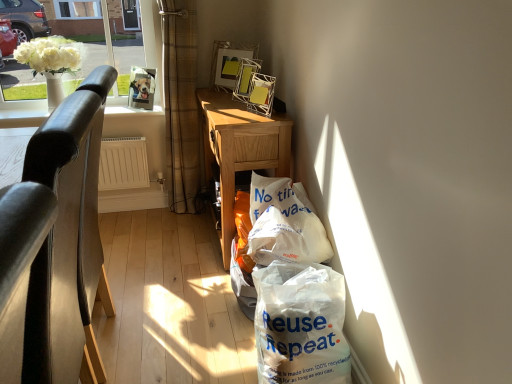
Question: Is black leather chair at left bigger or smaller than wooden desk at center?

Choices:
 (A) big
 (B) small

Answer: (B)

Question: From the image's perspective, is black leather chair at left positioned above or below wooden desk at center?

Choices:
 (A) below
 (B) above

Answer: (A)

Question: Based on their relative distances, which object is nearer to the black leather chair at left?

Choices:
 (A) wooden desk at center
 (B) metallic wire picture frame at upper center
 (C) brown plaid curtain at upper left
 (D) white plastic bag at lower right
 (E) white glass vase at upper left

Answer: (D)

Question: Which object is positioned closest to the white plastic bag at center?

Choices:
 (A) brown plaid curtain at upper left
 (B) black leather chair at left
 (C) metallic wire picture frame at upper center
 (D) white glass vase at upper left
 (E) white plastic bag at lower right

Answer: (E)